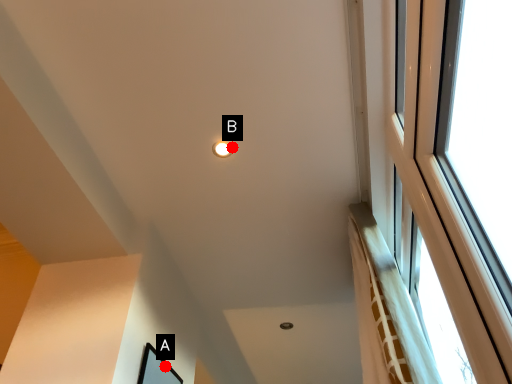
Question: Two points are circled on the image, labeled by A and B beside each circle. Which point is closer to the camera?

Choices:
 (A) A is closer
 (B) B is closer

Answer: (B)